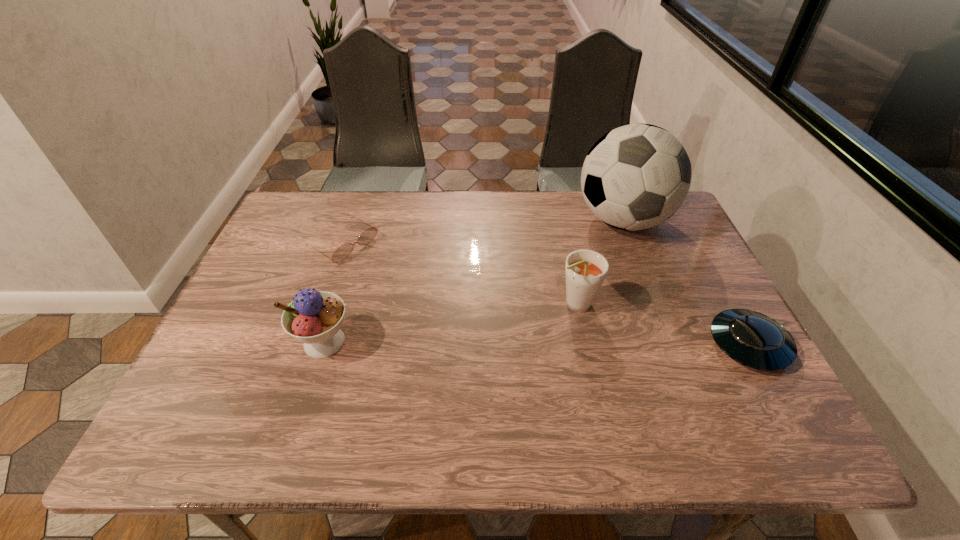
In order to click on free region located on the main logo of the tallest object in this screenshot , I will do `click(584, 282)`.

At what (x,y) coordinates should I click in order to perform the action: click on free location located 0.150m on the main logo of the tallest object. Please return your answer as a coordinate pair (x, y). The width and height of the screenshot is (960, 540). Looking at the image, I should click on (587, 278).

The image size is (960, 540). In order to click on free spot located 0.330m on the main logo of the tallest object in this screenshot , I will do click(x=559, y=321).

Image resolution: width=960 pixels, height=540 pixels. I want to click on free space located on the face of the shortest object, so click(x=381, y=266).

The image size is (960, 540). Identify the location of free spot located 0.300m on the face of the shortest object. (446, 305).

Identify the location of vacant space located on the face of the shortest object. Image resolution: width=960 pixels, height=540 pixels. (474, 321).

Locate an element on the screen. soccer ball present at the far edge is located at coordinates (637, 176).

What are the coordinates of `sunglasses that is at the far edge` in the screenshot? It's located at (x=341, y=253).

This screenshot has height=540, width=960. In order to click on object located in the near edge section of the desktop in this screenshot , I will do point(755,340).

What are the coordinates of `object located in the left edge section of the desktop` in the screenshot? It's located at (341, 253).